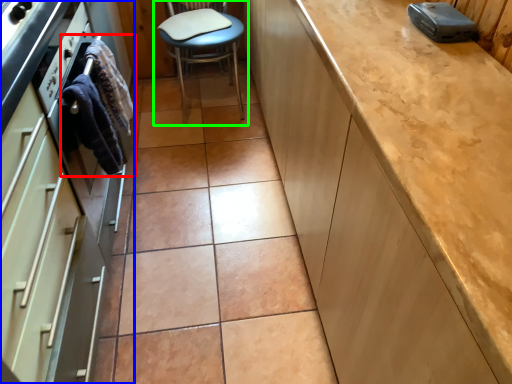
Question: Which object is the closest to the material (highlighted by a red box)? Choose among these: cabinetry (highlighted by a blue box) or chair (highlighted by a green box).

Choices:
 (A) cabinetry
 (B) chair

Answer: (A)